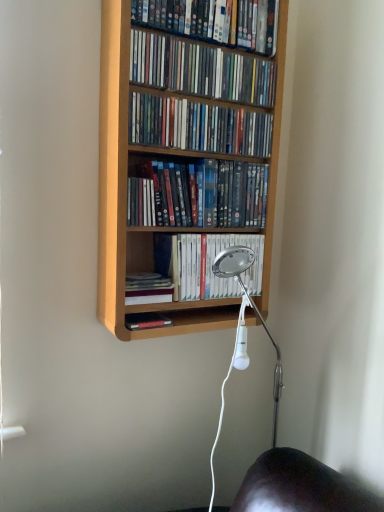
Question: Is matte plastic dvds at upper center, which ranks as the third book in top-to-bottom order, bigger than light wood bookcase at center?

Choices:
 (A) yes
 (B) no

Answer: (B)

Question: Considering the relative sizes of matte plastic dvds at upper center, which ranks as the third book in top-to-bottom order, and light wood bookcase at center in the image provided, is matte plastic dvds at upper center, which ranks as the third book in top-to-bottom order, smaller than light wood bookcase at center?

Choices:
 (A) yes
 (B) no

Answer: (A)

Question: Is matte plastic dvds at upper center, which appears as the fourth book when ordered from the bottom, aimed at light wood bookcase at center?

Choices:
 (A) yes
 (B) no

Answer: (A)

Question: Can we say matte plastic dvds at upper center, which appears as the fourth book when ordered from the bottom, lies outside light wood bookcase at center?

Choices:
 (A) yes
 (B) no

Answer: (B)

Question: Can you confirm if matte plastic dvds at upper center, which ranks as the third book in top-to-bottom order, is positioned to the right of light wood bookcase at center?

Choices:
 (A) yes
 (B) no

Answer: (A)

Question: Is hardcover book at center, arranged as the 1th book when ordered from the bottom, spatially inside matte plastic dvds at center, the 3th book from the bottom, or outside of it?

Choices:
 (A) inside
 (B) outside

Answer: (B)

Question: In terms of width, does hardcover book at center, arranged as the 1th book when ordered from the bottom, look wider or thinner when compared to matte plastic dvds at center, the 3th book from the bottom?

Choices:
 (A) wide
 (B) thin

Answer: (A)

Question: Is hardcover book at center, marked as the sixth book in a top-to-bottom arrangement, bigger or smaller than matte plastic dvds at center, positioned as the 4th book in top-to-bottom order?

Choices:
 (A) big
 (B) small

Answer: (B)

Question: Is hardcover book at center, marked as the sixth book in a top-to-bottom arrangement, taller or shorter than matte plastic dvds at center, the 3th book from the bottom?

Choices:
 (A) tall
 (B) short

Answer: (B)

Question: Considering the positions of matte plastic dvds at upper center, the sixth book positioned from the bottom, and matte plastic dvds at upper center, which is the 5th book from bottom to top, in the image, is matte plastic dvds at upper center, the sixth book positioned from the bottom, wider or thinner than matte plastic dvds at upper center, which is the 5th book from bottom to top,?

Choices:
 (A) wide
 (B) thin

Answer: (A)

Question: Which is correct: matte plastic dvds at upper center, the sixth book positioned from the bottom, is inside matte plastic dvds at upper center, which is the 5th book from bottom to top, or outside of it?

Choices:
 (A) outside
 (B) inside

Answer: (A)

Question: Considering the relative positions of matte plastic dvds at upper center, the sixth book positioned from the bottom, and matte plastic dvds at upper center, which is the 5th book from bottom to top, in the image provided, is matte plastic dvds at upper center, the sixth book positioned from the bottom, to the left or to the right of matte plastic dvds at upper center, which is the 5th book from bottom to top,?

Choices:
 (A) right
 (B) left

Answer: (A)

Question: From a real-world perspective, is matte plastic dvds at upper center, the first book positioned from the top, positioned above or below matte plastic dvds at upper center, which appears as the second book when viewed from the top?

Choices:
 (A) above
 (B) below

Answer: (A)

Question: Considering the positions of matte plastic dvds at center, positioned as the 4th book in top-to-bottom order, and hardcover book at center, marked as the sixth book in a top-to-bottom arrangement, in the image, is matte plastic dvds at center, positioned as the 4th book in top-to-bottom order, bigger or smaller than hardcover book at center, marked as the sixth book in a top-to-bottom arrangement,?

Choices:
 (A) big
 (B) small

Answer: (A)

Question: Based on their positions, is matte plastic dvds at center, positioned as the 4th book in top-to-bottom order, located to the left or right of hardcover book at center, marked as the sixth book in a top-to-bottom arrangement?

Choices:
 (A) right
 (B) left

Answer: (A)